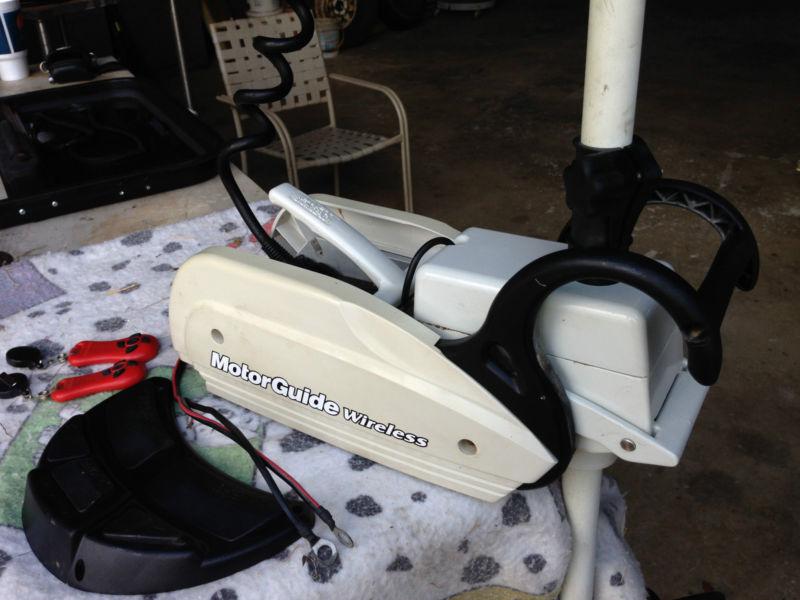
Locate an element on the screen. This screenshot has width=800, height=600. chair seat is located at coordinates (329, 149).